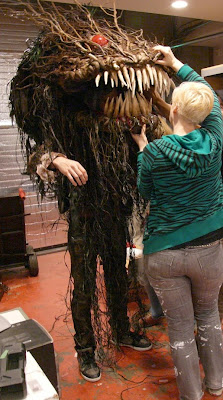
You are a GUI agent. You are given a task and a screenshot of the screen. Output one action in this format:
    pyautogui.click(x=<x>, y=<y>)
    Task: Click on the floor
    This screenshot has height=400, width=223.
    Given the screenshot: What is the action you would take?
    pyautogui.click(x=45, y=285)